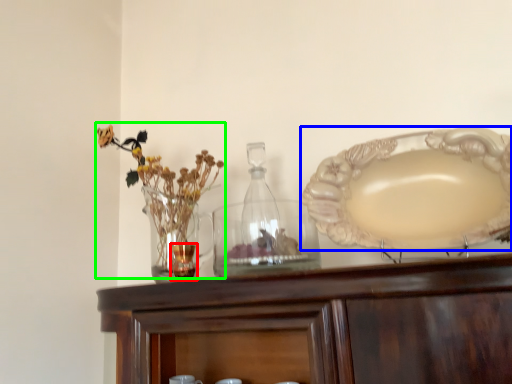
Question: Based on their relative distances, which object is nearer to tableware (highlighted by a red box)? Choose from plate (highlighted by a blue box) and floral arrangement (highlighted by a green box).

Choices:
 (A) plate
 (B) floral arrangement

Answer: (B)